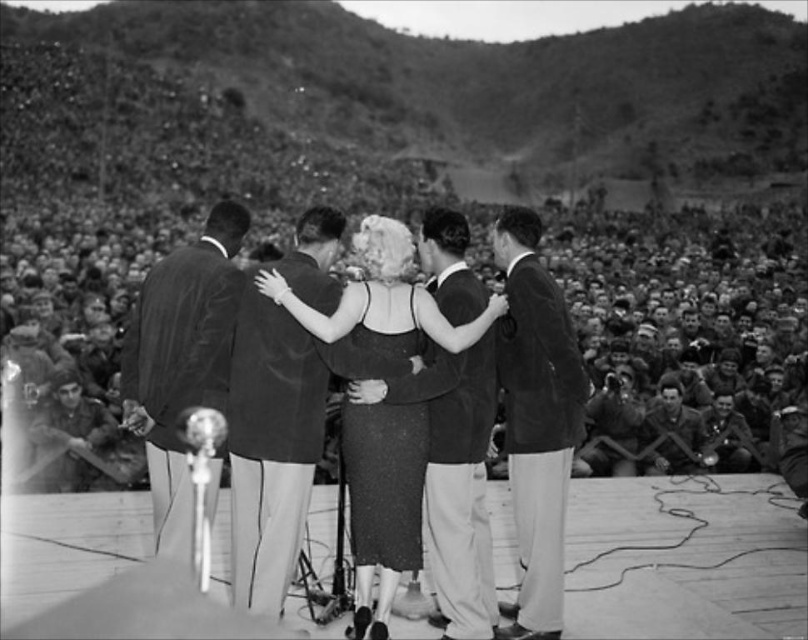
Question: Does smooth dark suit at center appear under camouflage fabric uniform at lower right?

Choices:
 (A) yes
 (B) no

Answer: (B)

Question: Is dark wool suit at center closer to the viewer compared to shiny black dress at center?

Choices:
 (A) no
 (B) yes

Answer: (A)

Question: Which point appears farthest from the camera in this image?

Choices:
 (A) (670, 445)
 (B) (187, 337)
 (C) (449, 515)

Answer: (A)

Question: Is suede jacket at right positioned at the back of smooth dark suit at center?

Choices:
 (A) yes
 (B) no

Answer: (B)

Question: Which of the following is the farthest from the observer?

Choices:
 (A) dark wool suit at center
 (B) dark gray uniformed crowd at center

Answer: (B)

Question: Which of these objects is positioned closest to the dark gray uniformed crowd at center?

Choices:
 (A) smooth dark suit at center
 (B) smooth black suit at center
 (C) dark wool suit at center

Answer: (C)